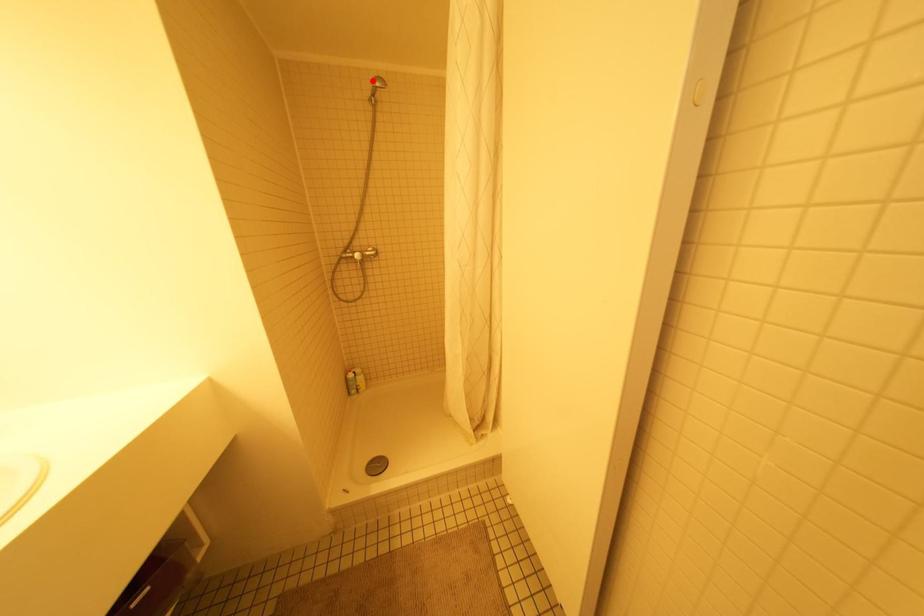
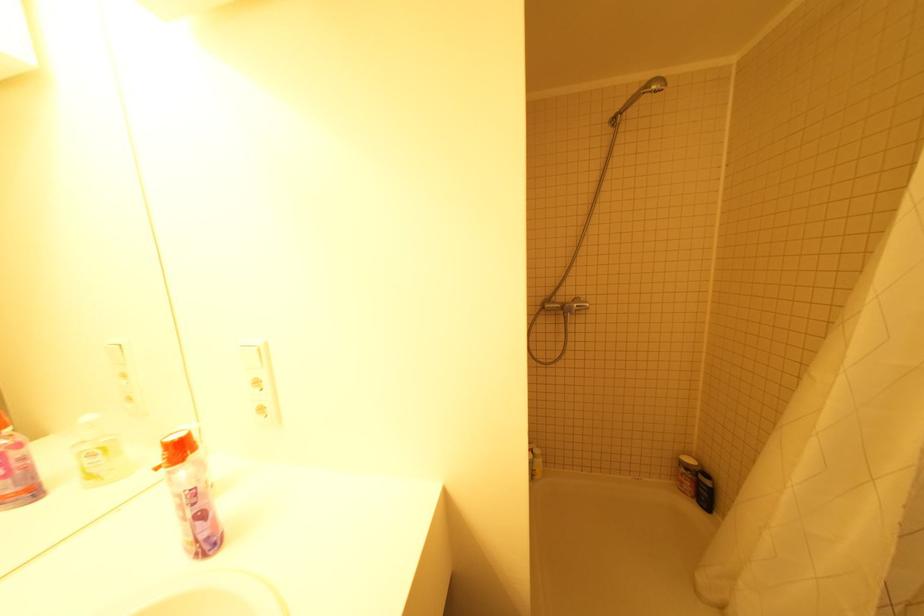
The point at the highlighted location is marked in the first image. Where is the corresponding point in the second image?

(649, 84)